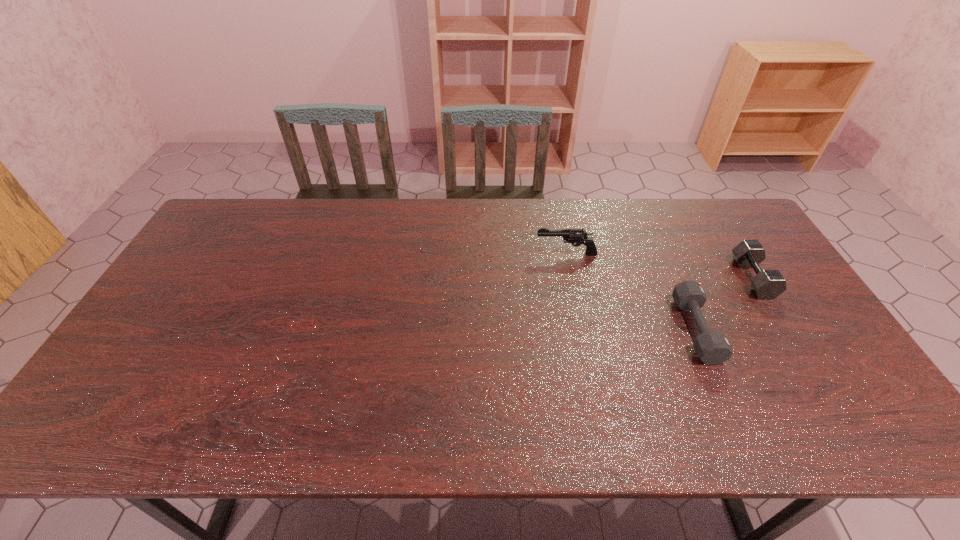
At what (x,y) coordinates should I click in order to perform the action: click on gun. Please return your answer as a coordinate pair (x, y). The width and height of the screenshot is (960, 540). Looking at the image, I should click on (579, 236).

Locate an element on the screen. the tallest object is located at coordinates (579, 236).

You are a GUI agent. You are given a task and a screenshot of the screen. Output one action in this format:
    pyautogui.click(x=<x>, y=<y>)
    Task: Click on the rightmost object
    The height and width of the screenshot is (540, 960).
    Given the screenshot: What is the action you would take?
    click(767, 284)

Image resolution: width=960 pixels, height=540 pixels. I want to click on the left dumbbell, so click(x=712, y=347).

I want to click on free spot located 0.360m at the end of the barrel of the farthest object, so click(x=422, y=254).

The width and height of the screenshot is (960, 540). I want to click on free region located at the end of the barrel of the farthest object, so click(x=479, y=254).

Identify the location of free region located 0.280m at the end of the barrel of the farthest object. (447, 254).

Identify the location of free space located 0.120m on the left of the right dumbbell. Image resolution: width=960 pixels, height=540 pixels. 699,278.

Locate an element on the screen. free location located 0.100m on the front of the left dumbbell is located at coordinates (727, 402).

Where is `object located at the right edge`? object located at the right edge is located at coordinates (767, 284).